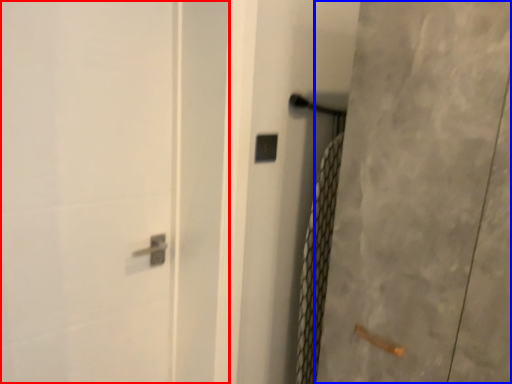
Question: Which object appears closest to the camera in this image, screen door (highlighted by a red box) or screen door (highlighted by a blue box)?

Choices:
 (A) screen door
 (B) screen door

Answer: (B)